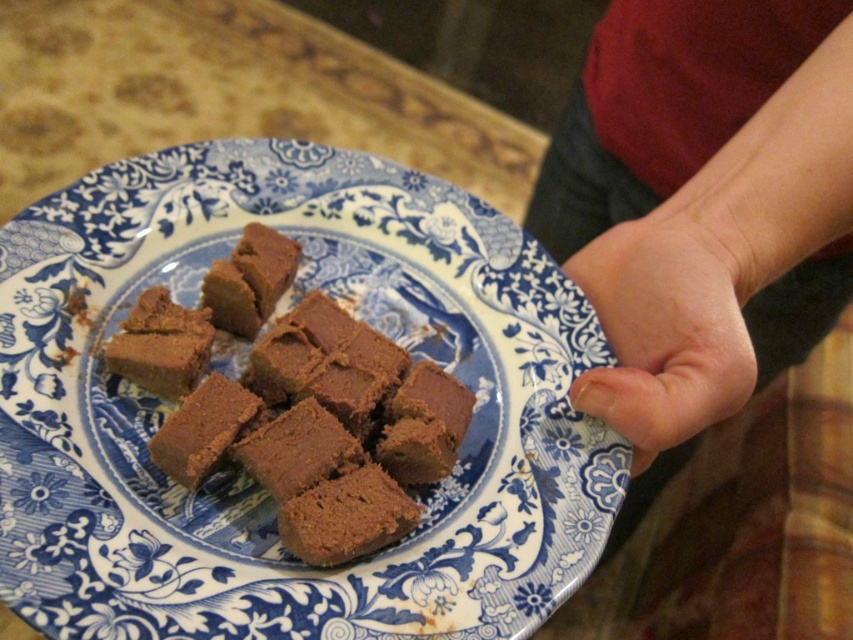
You are a chef preparing a dessert plating and need to place both the skinny white hand at center and the smooth skin at center on a small plate. Which object should you place first to ensure they both fit?

The smooth skin at center should be placed first because it is smaller in size than the skinny white hand at center, allowing enough space for both to fit on the small plate.

You are a food stylist arranging desserts on a plate. You have a brown matte fudge at center and a smooth skin at center. The client requires that the distance between them should be exactly 9 inches. Is the current arrangement compliant with the client request?

The distance between the brown matte fudge at center and the smooth skin at center is 9.17 inches, which is slightly more than the required 9 inches. Therefore, the current arrangement does not comply with the client request.